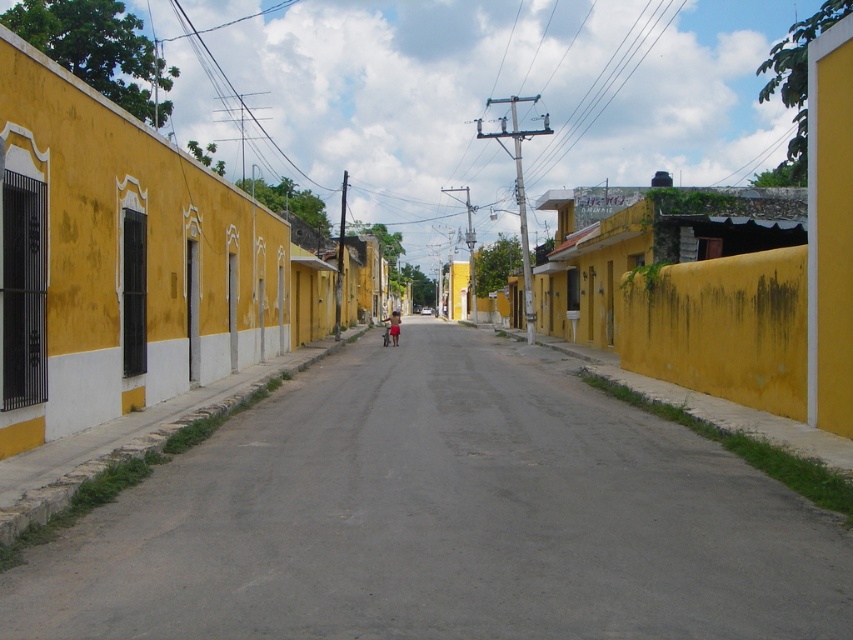
You are a delivery robot navigating a small town street. You need to deliver a package to a location marked by the point at coordinates (442, 518). According to the image, where is this point located?

The point at coordinates (442, 518) is on the smooth asphalt road at center, so the delivery robot should head towards the center of the road to reach the destination.

You are a pedestrian standing on the light brown skin at center. You want to cross the smooth asphalt road at center to reach a store on the other side. Which direction should you walk to get to the road?

Since the smooth asphalt road at center is to the right of light brown skin at center, you should walk to the right to reach the road.